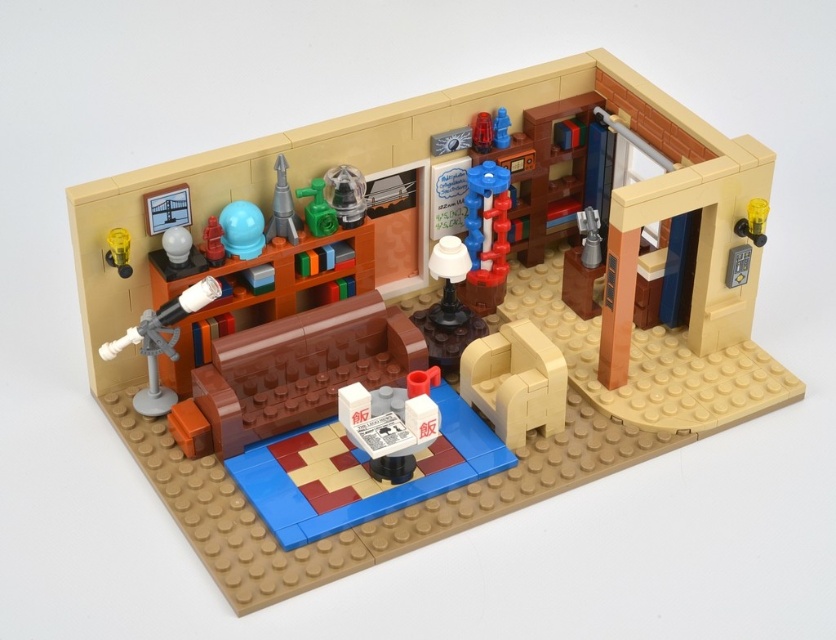
Question: Which point is closer to the camera taking this photo?

Choices:
 (A) (120, 260)
 (B) (482, 122)

Answer: (A)

Question: Is yellow plastic lamp at left positioned in front of matte red vase at upper center?

Choices:
 (A) no
 (B) yes

Answer: (B)

Question: From the image, what is the correct spatial relationship of white glossy cup at center in relation to matte red vase at upper center?

Choices:
 (A) below
 (B) above

Answer: (A)

Question: Which of the following is the farthest from the observer?

Choices:
 (A) shiny plastic tower at center
 (B) yellow plastic lamp at left
 (C) white glossy cup at center

Answer: (A)

Question: Can you confirm if shiny plastic tower at center is positioned to the right of blue plastic rocket at upper center?

Choices:
 (A) no
 (B) yes

Answer: (A)

Question: Among these points, which one is farthest from the camera?

Choices:
 (A) (490, 131)
 (B) (212, 262)
 (C) (130, 340)

Answer: (A)